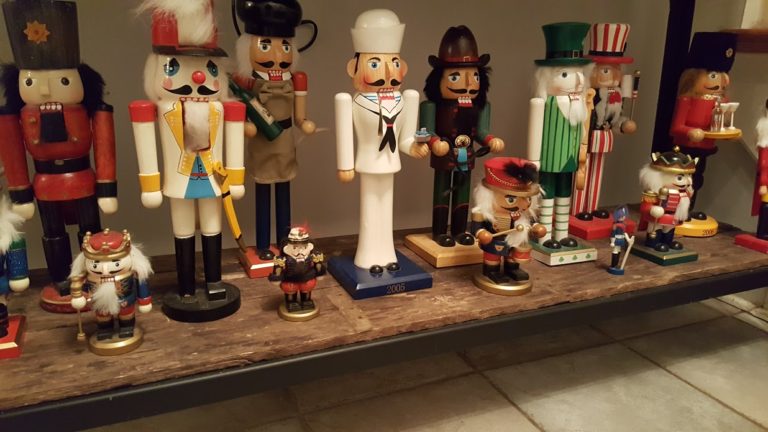
Identify the location of floor tiles. (533, 344), (679, 309), (736, 384), (760, 312), (750, 297), (432, 367), (477, 410), (634, 380), (273, 401), (293, 423).